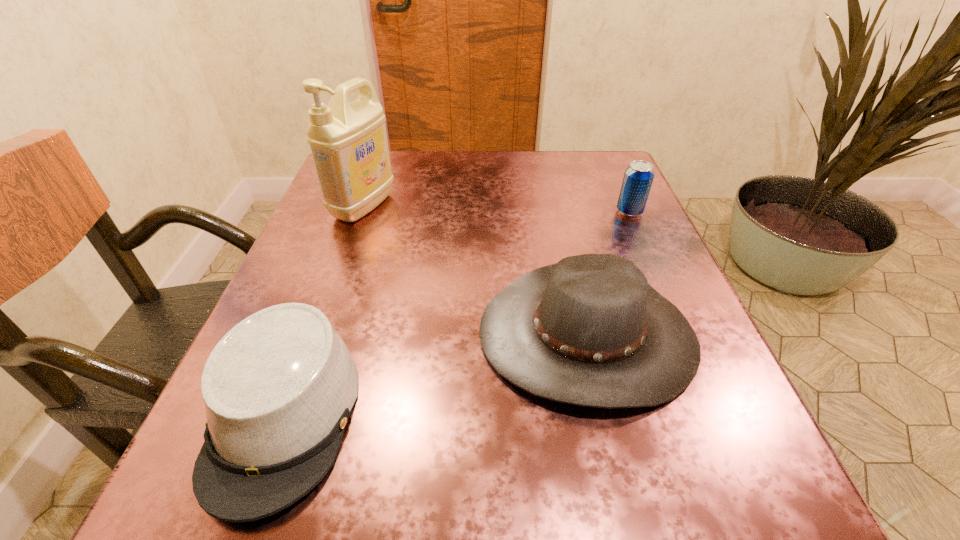
Locate an element on the screen. This screenshot has width=960, height=540. the tallest object is located at coordinates (348, 141).

Image resolution: width=960 pixels, height=540 pixels. What are the coordinates of `the taller hat` in the screenshot? It's located at (589, 330).

Find the location of `beer can`. beer can is located at coordinates (638, 177).

Locate an element on the screen. the shorter hat is located at coordinates (279, 387).

Locate an element on the screen. The height and width of the screenshot is (540, 960). free space located 0.350m on the right of the detergent is located at coordinates (555, 206).

In order to click on blank space located 0.050m on the back of the beer can in this screenshot , I will do `click(621, 192)`.

Image resolution: width=960 pixels, height=540 pixels. Find the location of `object that is at the far edge`. object that is at the far edge is located at coordinates (348, 141).

Locate an element on the screen. object present at the near edge is located at coordinates coord(279,387).

You are a GUI agent. You are given a task and a screenshot of the screen. Output one action in this format:
    pyautogui.click(x=<x>, y=<y>)
    Task: Click on the detergent that is at the left edge
    The height and width of the screenshot is (540, 960).
    Given the screenshot: What is the action you would take?
    pyautogui.click(x=348, y=141)

Where is `hat that is at the left edge`? The image size is (960, 540). hat that is at the left edge is located at coordinates (279, 387).